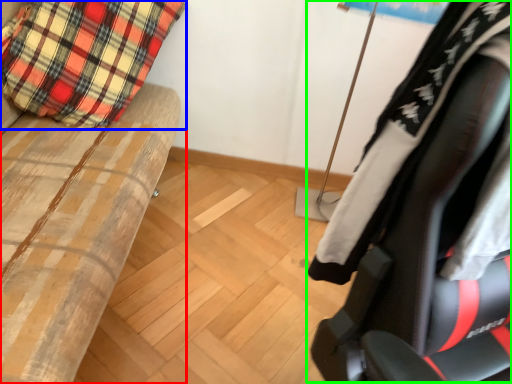
Question: Based on their relative distances, which object is nearer to furniture (highlighted by a red box)? Choose from pillow (highlighted by a blue box) and chair (highlighted by a green box).

Choices:
 (A) pillow
 (B) chair

Answer: (A)